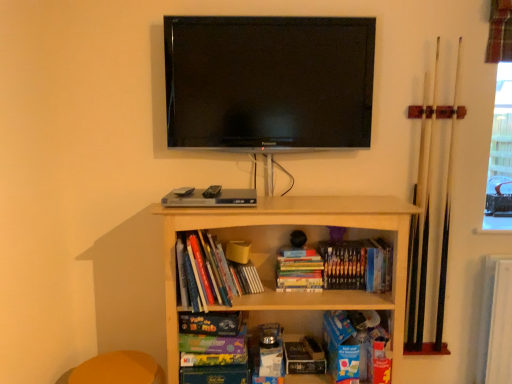
In order to face wooden shelf at center, should I rotate leftwards or rightwards?

It's best to rotate right around 3.309 degrees.

The width and height of the screenshot is (512, 384). What do you see at coordinates (210, 273) in the screenshot?
I see `hardcover books at center, the first book viewed from the left` at bounding box center [210, 273].

What do you see at coordinates (304, 356) in the screenshot? I see `hardcover book at center, positioned as the first paperback book in right-to-left order` at bounding box center [304, 356].

What is the approximate width of hardcover book at center, which is the 1th paperback book in bottom-to-top order?

hardcover book at center, which is the 1th paperback book in bottom-to-top order, is 7.13 inches wide.

At what (x,y) coordinates should I click in order to perform the action: click on matte purple paperback book at center, which is counted as the 2th paperback book, starting from the bottom. Please return your answer as a coordinate pair (x, y). Looking at the image, I should click on (212, 344).

Identify the location of hardcover book at center, which is counted as the third book, starting from the left. Image resolution: width=512 pixels, height=384 pixels. (337, 267).

Identify the location of wooden shelf at center. This screenshot has height=384, width=512. (272, 238).

Looking at this image, is the position of hardcover books at center, which appears as the third book when viewed from the right, less distant than that of matte purple paperback book at center, which is the 2th paperback book from right to left?

Yes, it is.

From the image's perspective, does hardcover books at center, which appears as the third book when viewed from the right, appear higher than matte purple paperback book at center, the second paperback book when ordered from left to right?

Correct, hardcover books at center, which appears as the third book when viewed from the right, appears higher than matte purple paperback book at center, the second paperback book when ordered from left to right, in the image.

From a real-world perspective, which object rests below the other?

From a 3D spatial view, matte purple paperback book at center, which is the 2th paperback book from right to left, is below.

Is hardcover books at center, the first book viewed from the left, positioned with its back to matte purple paperback book at center, the second paperback book when ordered from left to right?

That's not correct — hardcover books at center, the first book viewed from the left, is not looking away from matte purple paperback book at center, the second paperback book when ordered from left to right.

Consider the image. From a real-world perspective, is green matte board game at center, which ranks as the first paperback book in left-to-right order, physically below hardcover book at center, which is the 1th book from right to left?

Yes.

Is green matte board game at center, the 3th paperback book positioned from the bottom, positioned beyond the bounds of hardcover book at center, which is counted as the third book, starting from the left?

green matte board game at center, the 3th paperback book positioned from the bottom, is positioned outside hardcover book at center, which is counted as the third book, starting from the left.

Would you say green matte board game at center, which ranks as the first paperback book in left-to-right order, is to the left or to the right of hardcover book at center, which is the 1th book from right to left, in the picture?

From the image, it's evident that green matte board game at center, which ranks as the first paperback book in left-to-right order, is to the left of hardcover book at center, which is the 1th book from right to left.

In the scene shown: What's the angular difference between green matte board game at center, the 3th paperback book when ordered from right to left, and hardcover book at center, which is counted as the third book, starting from the left,'s facing directions?

green matte board game at center, the 3th paperback book when ordered from right to left, and hardcover book at center, which is counted as the third book, starting from the left, are facing 8.1 degrees away from each other.

Where is `swivel chair below the hardcover books at center, the first book viewed from the left (from the image's perspective)`? swivel chair below the hardcover books at center, the first book viewed from the left (from the image's perspective) is located at coordinates (118, 369).

From the image's perspective, which one is positioned lower, hardcover books at center, the first book viewed from the left, or orange fabric swivel chair at lower left?

orange fabric swivel chair at lower left, from the image's perspective.

Which is nearer, (238,275) or (144,378)?

Point (238,275)

Which object is positioned more to the right, flat screen tv at upper center or matte purple paperback book at center, the 2th paperback book positioned from the top?

From the viewer's perspective, flat screen tv at upper center appears more on the right side.

Considering the positions of point (368, 73) and point (192, 350), is point (368, 73) closer or farther from the camera than point (192, 350)?

Point (368, 73) is farther from the camera than point (192, 350).

Locate an element on the screen. Image resolution: width=512 pixels, height=384 pixels. the 2nd paperback book in front of the flat screen tv at upper center, starting your count from the anchor is located at coordinates (212, 344).

In terms of width, does flat screen tv at upper center look wider or thinner when compared to matte purple paperback book at center, the second paperback book when ordered from left to right?

In the image, flat screen tv at upper center appears to be more narrow than matte purple paperback book at center, the second paperback book when ordered from left to right.

Which object is positioned more to the left, matte purple paperback book at center, the second paperback book when ordered from left to right, or flat screen tv at upper center?

matte purple paperback book at center, the second paperback book when ordered from left to right, is more to the left.

Is matte purple paperback book at center, which is counted as the 2th paperback book, starting from the bottom, turned away from flat screen tv at upper center?

No, matte purple paperback book at center, which is counted as the 2th paperback book, starting from the bottom, is not facing the opposite direction of flat screen tv at upper center.

Choose the correct answer: Is matte purple paperback book at center, which is the 2th paperback book from right to left, inside flat screen tv at upper center or outside it?

matte purple paperback book at center, which is the 2th paperback book from right to left, is not inside flat screen tv at upper center, it's outside.

From the picture: From the image's perspective, relative to flat screen tv at upper center, is matte purple paperback book at center, the second paperback book when ordered from left to right, above or below?

Based on their image positions, matte purple paperback book at center, the second paperback book when ordered from left to right, is located beneath flat screen tv at upper center.

Looking at this image, between wooden shelf at center and flat screen tv at upper center, which one is positioned in front?

wooden shelf at center.

Is wooden shelf at center positioned with its back to flat screen tv at upper center?

wooden shelf at center does not have its back to flat screen tv at upper center.

Identify the location of television that appears above the wooden shelf at center (from the image's perspective). Image resolution: width=512 pixels, height=384 pixels. (269, 82).

Considering the positions of objects wooden shelf at center and flat screen tv at upper center in the image provided, who is more to the left, wooden shelf at center or flat screen tv at upper center?

Positioned to the left is flat screen tv at upper center.

Can you confirm if hardcover book at center, which is counted as the third book, starting from the left, is wider than hardcover book at center, which ranks as the 3th paperback book in top-to-bottom order?

Incorrect, the width of hardcover book at center, which is counted as the third book, starting from the left, does not surpass that of hardcover book at center, which ranks as the 3th paperback book in top-to-bottom order.

Is hardcover book at center, which is the 1th book from right to left, shorter than hardcover book at center, positioned as the first paperback book in right-to-left order?

No.

From the image's perspective, is hardcover book at center, which is the 1th book from right to left, below hardcover book at center, which is the 1th paperback book in bottom-to-top order?

No.

Where is `the 2nd paperback book positioned below the hardcover books at center, which appears as the third book when viewed from the right (from a real-world perspective)`? This screenshot has height=384, width=512. the 2nd paperback book positioned below the hardcover books at center, which appears as the third book when viewed from the right (from a real-world perspective) is located at coordinates (212, 344).

Locate an element on the screen. The width and height of the screenshot is (512, 384). paperback book that is the 1st one when counting forward from the hardcover book at center, which is counted as the third book, starting from the left is located at coordinates (210, 323).

Estimate the real-world distances between objects in this image. Which object is closer to hardcover books at center, arranged as the second book when viewed from the right, hardcover book at center, which is counted as the third book, starting from the left, or matte purple paperback book at center, which is counted as the 2th paperback book, starting from the bottom?

The object closer to hardcover books at center, arranged as the second book when viewed from the right, is hardcover book at center, which is counted as the third book, starting from the left.

Estimate the real-world distances between objects in this image. Which object is further from hardcover book at center, which is counted as the third book, starting from the left, orange fabric swivel chair at lower left or hardcover books at center, which is the second book from left to right?

Among the two, orange fabric swivel chair at lower left is located further to hardcover book at center, which is counted as the third book, starting from the left.

From the image, which object appears to be nearer to hardcover book at center, which is counted as the third book, starting from the left, hardcover books at center, arranged as the second book when viewed from the right, or flat screen tv at upper center?

hardcover books at center, arranged as the second book when viewed from the right, is positioned closer to the anchor hardcover book at center, which is counted as the third book, starting from the left.

Looking at the image, which one is located closer to wooden shelf at center, hardcover book at center, which is the 1th paperback book in bottom-to-top order, or hardcover books at center, the first book viewed from the left?

hardcover books at center, the first book viewed from the left, is positioned closer to the anchor wooden shelf at center.

When comparing their distances from hardcover book at center, which is counted as the third book, starting from the left, does flat screen tv at upper center or green matte board game at center, the 3th paperback book positioned from the bottom, seem closer?

green matte board game at center, the 3th paperback book positioned from the bottom, is closer to hardcover book at center, which is counted as the third book, starting from the left.

Considering their positions, is hardcover book at center, which is the 1th book from right to left, positioned further to hardcover books at center, which appears as the third book when viewed from the right, than wooden shelf at center?

Among the two, hardcover book at center, which is the 1th book from right to left, is located further to hardcover books at center, which appears as the third book when viewed from the right.

Based on their spatial positions, is wooden shelf at center or hardcover book at center, which is the 1th book from right to left, further from hardcover books at center, the first book viewed from the left?

hardcover book at center, which is the 1th book from right to left, is further to hardcover books at center, the first book viewed from the left.

Which object lies nearer to the anchor point flat screen tv at upper center, hardcover books at center, which appears as the third book when viewed from the right, or hardcover book at center, which is counted as the third book, starting from the left?

hardcover book at center, which is counted as the third book, starting from the left, is closer to flat screen tv at upper center.

Locate an element on the screen. This screenshot has height=384, width=512. book between matte purple paperback book at center, which is the 2th paperback book from right to left, and hardcover book at center, which is the 1th book from right to left, from left to right is located at coordinates (298, 271).

Identify the location of shelf between orange fabric swivel chair at lower left and hardcover book at center, which is counted as the third book, starting from the left. The image size is (512, 384). (272, 238).

Locate an element on the screen. The image size is (512, 384). paperback book between green matte board game at center, which ranks as the first paperback book in left-to-right order, and hardcover book at center, positioned as the 3th paperback book in left-to-right order is located at coordinates (212, 344).

Find the location of `paperback book that lies between flat screen tv at upper center and matte purple paperback book at center, which is the 2th paperback book from right to left, from top to bottom`. paperback book that lies between flat screen tv at upper center and matte purple paperback book at center, which is the 2th paperback book from right to left, from top to bottom is located at coordinates (210, 323).